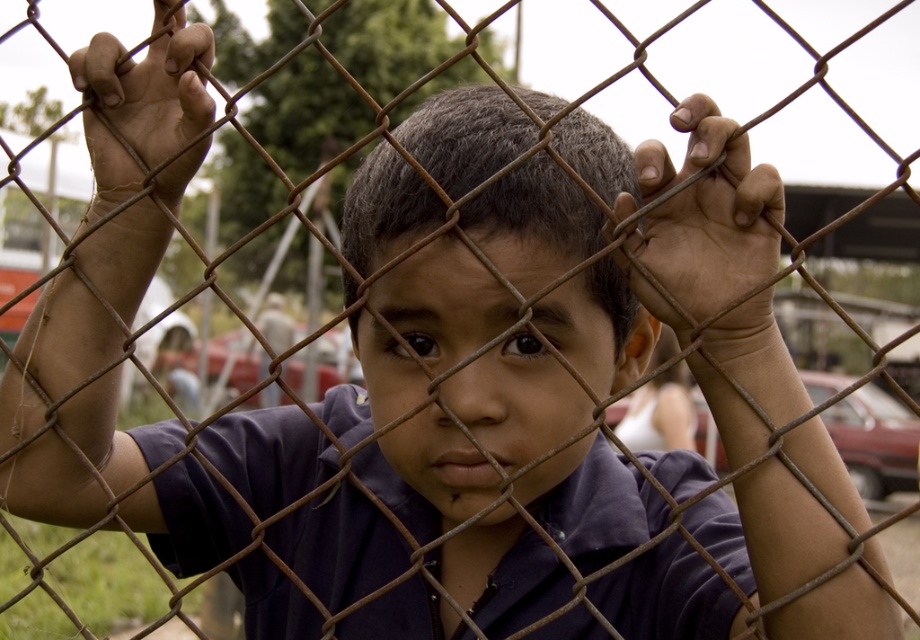
Question: Among these points, which one is nearest to the camera?

Choices:
 (A) [x=207, y=29]
 (B) [x=702, y=221]

Answer: (B)

Question: Can you confirm if brown rough wire at center is smaller than brown rusted wire mesh at left?

Choices:
 (A) yes
 (B) no

Answer: (A)

Question: Does matte purple shirt at center have a lesser width compared to brown rough wire at center?

Choices:
 (A) no
 (B) yes

Answer: (A)

Question: Which is nearer to the matte purple shirt at center?

Choices:
 (A) brown rusted wire mesh at left
 (B) brown rough wire at center

Answer: (B)

Question: Among these points, which one is farthest from the camera?

Choices:
 (A) (186, 177)
 (B) (407, 227)

Answer: (A)

Question: Observing the image, what is the correct spatial positioning of brown rough wire at center in reference to brown rusted wire mesh at left?

Choices:
 (A) right
 (B) left

Answer: (A)